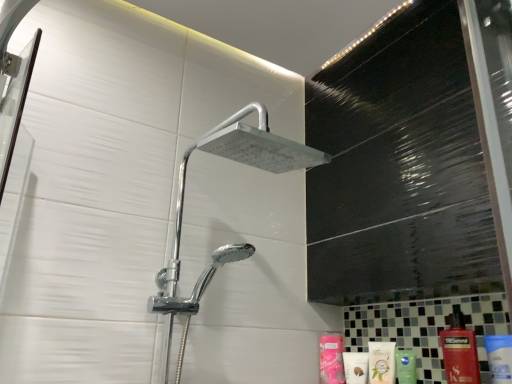
Question: From a real-world perspective, is pink matte lotion at lower center, the second toiletry in the front-to-back sequence, positioned above or below white glossy mouthwash at lower right?

Choices:
 (A) below
 (B) above

Answer: (B)

Question: Do you think pink matte lotion at lower center, the second toiletry in the front-to-back sequence, is within white glossy mouthwash at lower right, or outside of it?

Choices:
 (A) inside
 (B) outside

Answer: (B)

Question: Considering the real-world distances, which object is closest to the pink matte lotion at lower center, the second toiletry in the front-to-back sequence?

Choices:
 (A) white matte lotion at lower right, the 1th toiletry when ordered from front to back
 (B) white glossy mouthwash at lower right
 (C) red glossy shampoo at lower right

Answer: (A)

Question: Based on their relative distances, which object is nearer to the white glossy mouthwash at lower right?

Choices:
 (A) white matte lotion at lower right, the 1th toiletry when ordered from front to back
 (B) red glossy shampoo at lower right
 (C) pink matte lotion at lower center, the second toiletry in the front-to-back sequence

Answer: (A)